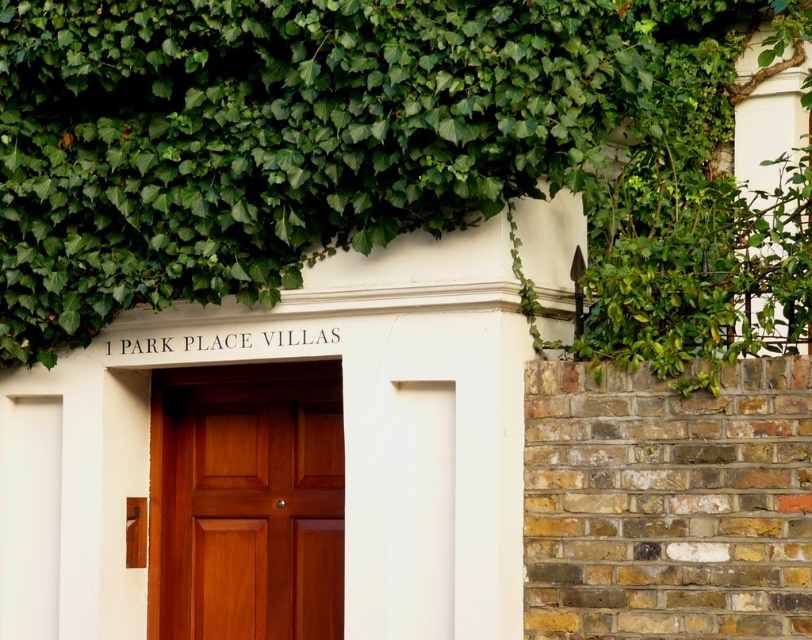
Question: Can you confirm if green leafy ivy at upper center is bigger than mahogany wood door at center?

Choices:
 (A) yes
 (B) no

Answer: (A)

Question: Which point is farther from the camera taking this photo?

Choices:
 (A) (227, 371)
 (B) (534, 93)

Answer: (A)

Question: Among these objects, which one is farthest from the camera?

Choices:
 (A) green leafy ivy at upper center
 (B) mahogany wood door at center

Answer: (B)

Question: Can you confirm if green leafy ivy at upper center is positioned to the right of mahogany wood door at center?

Choices:
 (A) yes
 (B) no

Answer: (A)

Question: From the image, what is the correct spatial relationship of green leafy ivy at upper center in relation to mahogany wood door at center?

Choices:
 (A) below
 (B) above

Answer: (B)